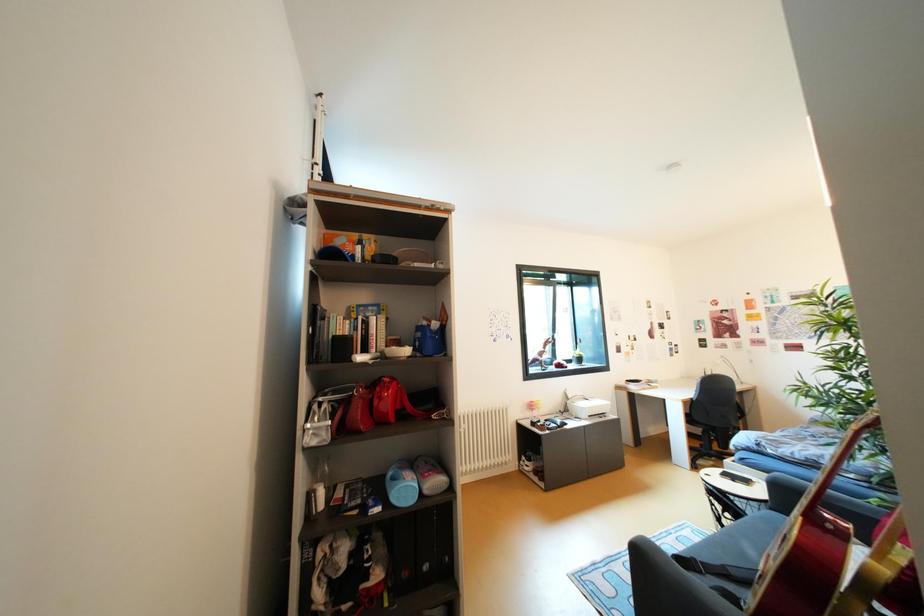
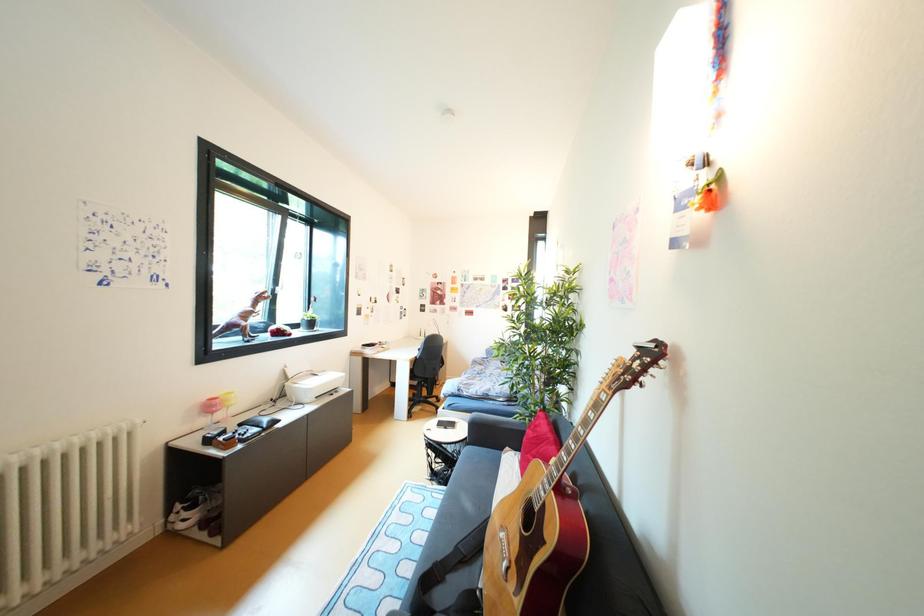
Question: The camera is either moving clockwise (left) or counter-clockwise (right) around the object. The first image is from the beginning of the video and the second image is from the end. Is the camera moving left or right when shooting the video?

Choices:
 (A) Left
 (B) Right

Answer: (A)